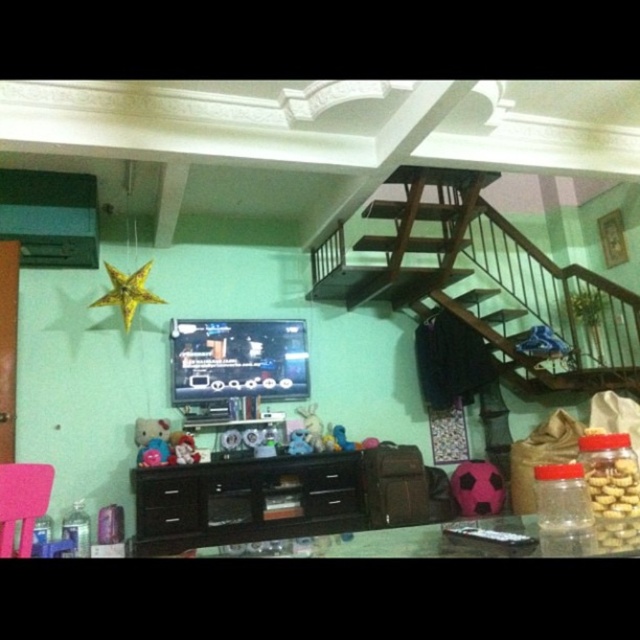
You are a parent trying to place a new toy on the highest point between the pink fabric chair at lower left and the plush pink teddy bear at center. Which object should you choose to place the toy?

The pink fabric chair at lower left is much taller than the plush pink teddy bear at center, so you should place the toy on the pink fabric chair at lower left.

You are a delivery person carrying a large package and need to place it in the living room. You see the wooden stairs at upper center and the pink fabric chair at lower left. Which object is closer to you so you can place the package there?

The wooden stairs at upper center is further to the viewer than pink fabric chair at lower left, so the pink fabric chair at lower left is closer and you can place the package there.